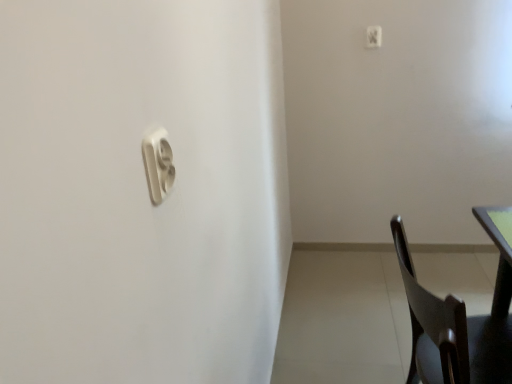
Question: From a real-world perspective, is green matte table top at right located higher than dark wood chair at lower right?

Choices:
 (A) yes
 (B) no

Answer: (A)

Question: From the image's perspective, is green matte table top at right located beneath dark wood chair at lower right?

Choices:
 (A) no
 (B) yes

Answer: (A)

Question: Can you confirm if green matte table top at right is positioned to the left of dark wood chair at lower right?

Choices:
 (A) yes
 (B) no

Answer: (B)

Question: Can you confirm if green matte table top at right is bigger than dark wood chair at lower right?

Choices:
 (A) yes
 (B) no

Answer: (B)

Question: Are green matte table top at right and dark wood chair at lower right far apart?

Choices:
 (A) no
 (B) yes

Answer: (A)

Question: From the image's perspective, is white plastic light switch at upper center, which is the first light switch from front to back, positioned above or below white plastic light switch at upper right, which ranks as the first light switch in right-to-left order?

Choices:
 (A) below
 (B) above

Answer: (A)

Question: Is white plastic light switch at upper center, the first light switch positioned from the bottom, wider or thinner than white plastic light switch at upper right, which is counted as the first light switch, starting from the back?

Choices:
 (A) wide
 (B) thin

Answer: (A)

Question: Considering the positions of point (164, 175) and point (366, 41), is point (164, 175) closer or farther from the camera than point (366, 41)?

Choices:
 (A) farther
 (B) closer

Answer: (B)

Question: Is white plastic light switch at upper center, which is the 1th light switch in left-to-right order, inside or outside of white plastic light switch at upper right, acting as the 2th light switch starting from the front?

Choices:
 (A) inside
 (B) outside

Answer: (B)

Question: Considering the positions of dark wood chair at lower right and white plastic light switch at upper center, which is the first light switch from front to back, in the image, is dark wood chair at lower right wider or thinner than white plastic light switch at upper center, which is the first light switch from front to back,?

Choices:
 (A) thin
 (B) wide

Answer: (B)

Question: Is dark wood chair at lower right inside or outside of white plastic light switch at upper center, which is the 1th light switch in left-to-right order?

Choices:
 (A) inside
 (B) outside

Answer: (B)

Question: Considering their positions, is dark wood chair at lower right located in front of or behind white plastic light switch at upper center, which is the first light switch from front to back?

Choices:
 (A) front
 (B) behind

Answer: (B)

Question: Is point (452, 369) closer or farther from the camera than point (162, 150)?

Choices:
 (A) farther
 (B) closer

Answer: (A)

Question: Is green matte table top at right taller or shorter than dark wood chair at lower right?

Choices:
 (A) short
 (B) tall

Answer: (A)

Question: Looking at their shapes, would you say green matte table top at right is wider or thinner than dark wood chair at lower right?

Choices:
 (A) wide
 (B) thin

Answer: (B)